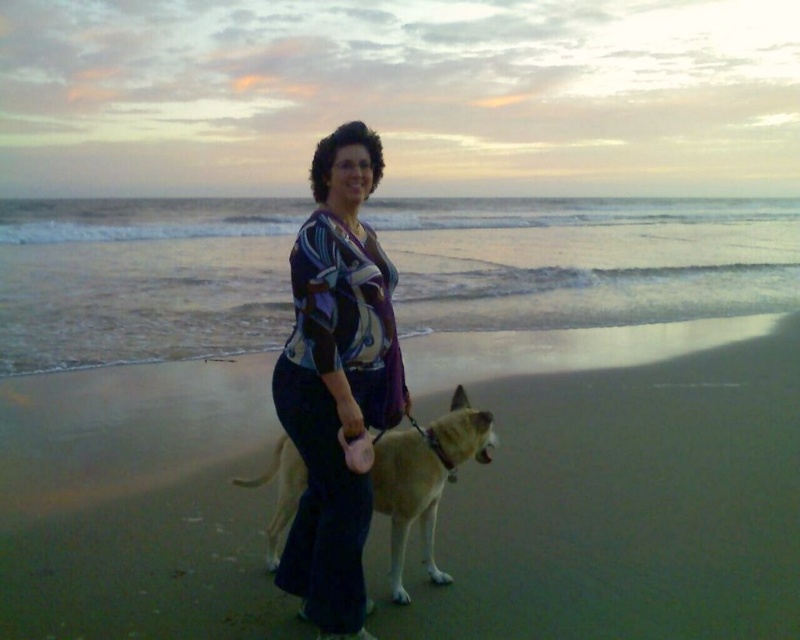
Which of these two, sandy brown sand at center or fuzzy tan dog at center, stands taller?

fuzzy tan dog at center

Can you confirm if sandy brown sand at center is positioned above fuzzy tan dog at center?

Actually, sandy brown sand at center is below fuzzy tan dog at center.

Is point (229, 442) closer to viewer compared to point (274, 476)?

No, (229, 442) is behind (274, 476).

Where is `sandy brown sand at center`? sandy brown sand at center is located at coordinates (616, 486).

Is sandy brown sand at center closer to camera compared to printed silk blouse at center?

That is False.

Who is more forward, (480, 500) or (356, 211)?

Point (356, 211) is in front.

Locate an element on the screen. sandy brown sand at center is located at coordinates (616, 486).

Does printed silk blouse at center appear over fuzzy tan dog at center?

Yes, printed silk blouse at center is above fuzzy tan dog at center.

Does point (330, 259) come in front of point (392, 566)?

Yes, point (330, 259) is in front of point (392, 566).

Who is more forward, (348,284) or (450,474)?

Point (348,284) is in front.

The height and width of the screenshot is (640, 800). I want to click on printed silk blouse at center, so click(336, 380).